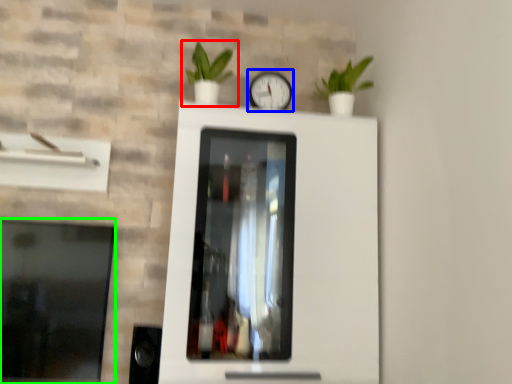
Question: Which is nearer to the houseplant (highlighted by a red box)? clock (highlighted by a blue box) or window (highlighted by a green box).

Choices:
 (A) clock
 (B) window

Answer: (A)